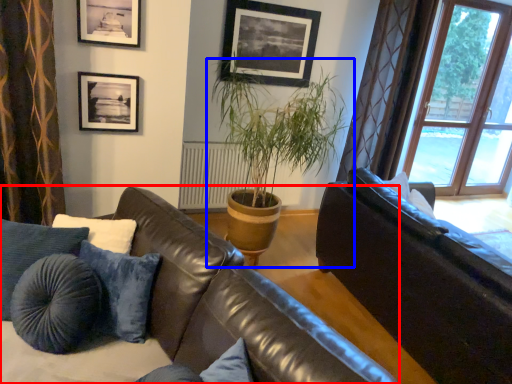
Question: Which object is closer to the camera taking this photo, studio couch (highlighted by a red box) or houseplant (highlighted by a blue box)?

Choices:
 (A) studio couch
 (B) houseplant

Answer: (A)